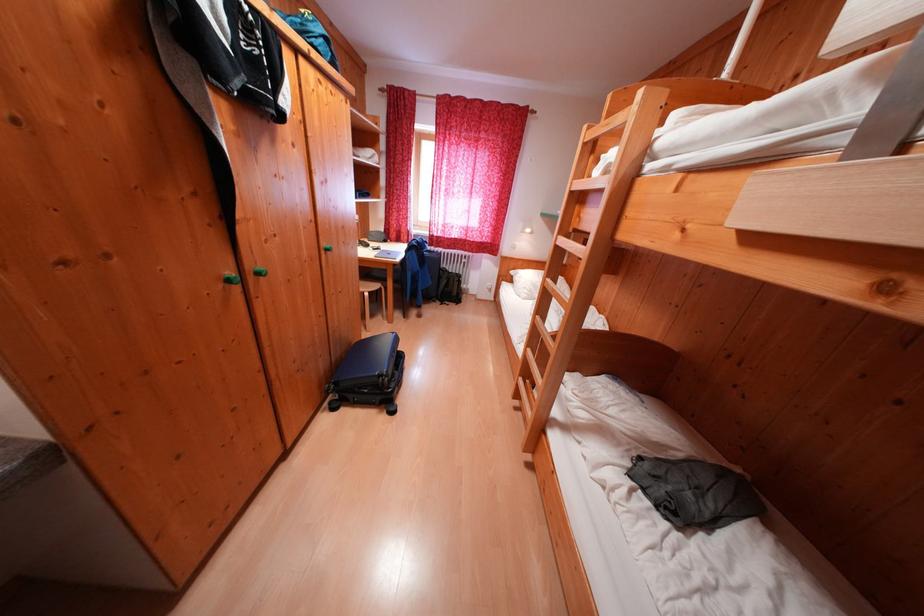
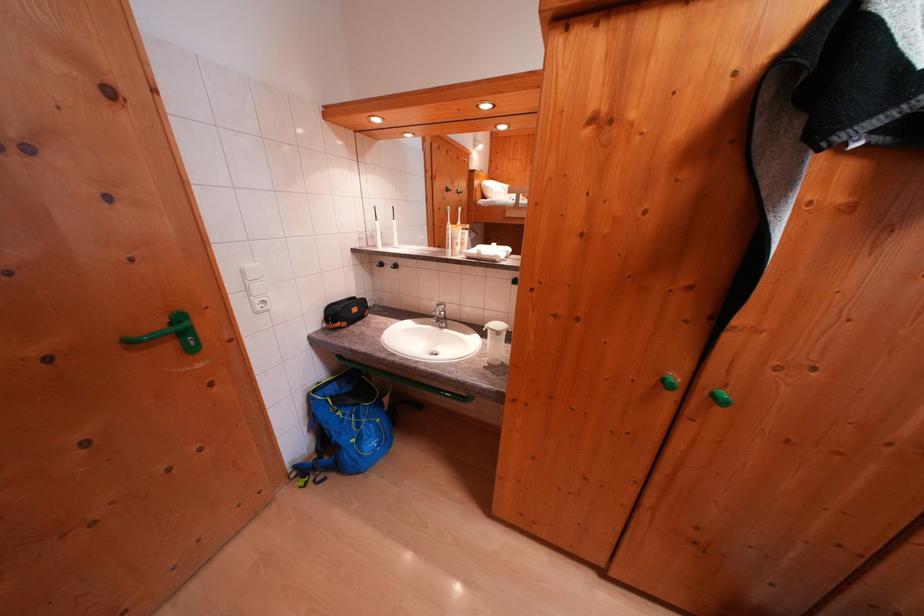
How did the camera likely rotate?

The camera rotated toward left-down.